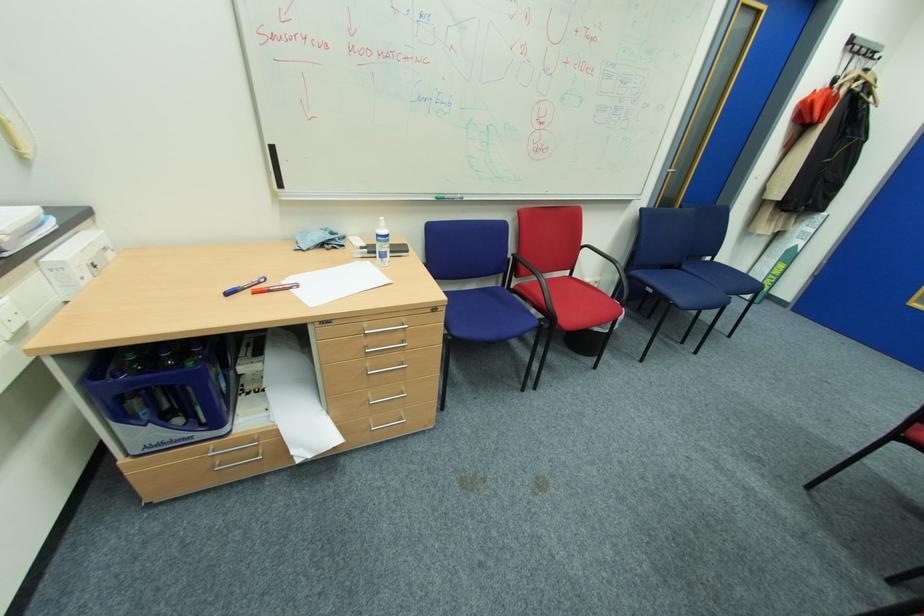
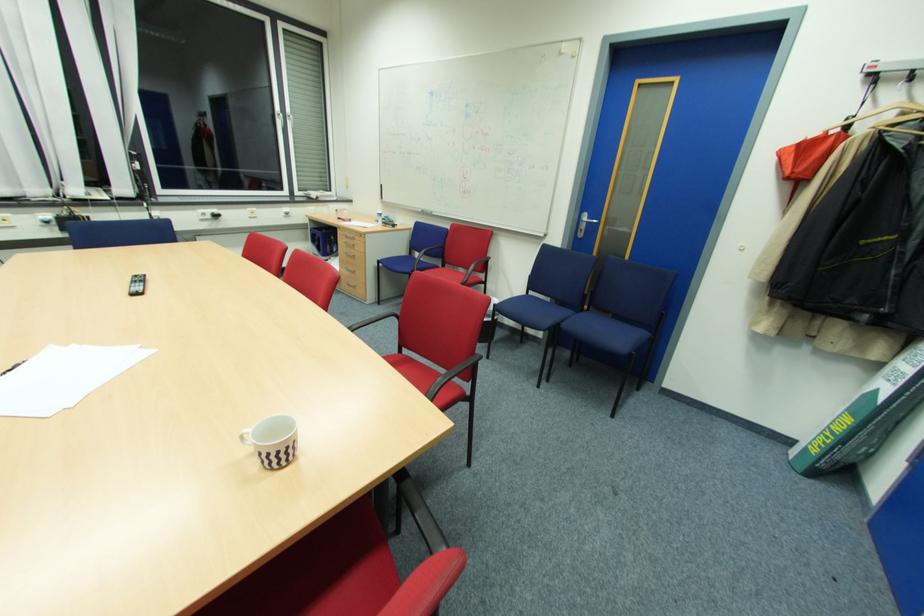
Where in the second image is the point corresponding to the point at 338,322 from the first image?

(344, 229)